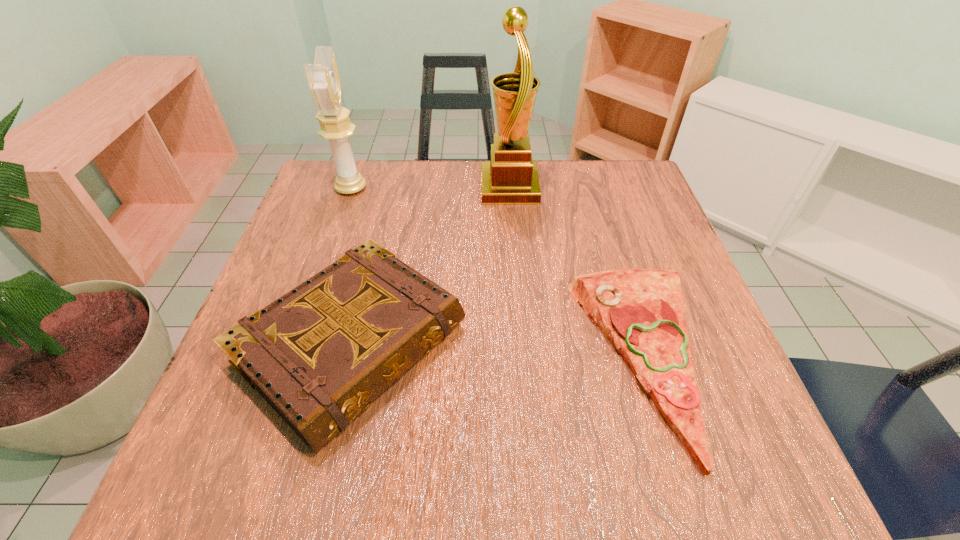
At what (x,y) coordinates should I click in order to perform the action: click on the tallest object. Please return your answer as a coordinate pair (x, y). The height and width of the screenshot is (540, 960). Looking at the image, I should click on (511, 177).

Identify the location of the third object from left to right. (511, 177).

The image size is (960, 540). What are the coordinates of `the left award` in the screenshot? It's located at (323, 77).

Identify the location of the third shortest object. (323, 77).

Find the location of a particular element. The image size is (960, 540). hardback book is located at coordinates (319, 355).

You are a GUI agent. You are given a task and a screenshot of the screen. Output one action in this format:
    pyautogui.click(x=<x>, y=<y>)
    Task: Click on the rightmost object
    This screenshot has height=540, width=960.
    Given the screenshot: What is the action you would take?
    pyautogui.click(x=641, y=311)

This screenshot has height=540, width=960. What are the coordinates of `the shortest object` in the screenshot? It's located at (641, 311).

At what (x,y) coordinates should I click in order to perform the action: click on free space located 0.380m on the front-facing side of the right award. Please return your answer as a coordinate pair (x, y). Looking at the image, I should click on (333, 188).

You are a GUI agent. You are given a task and a screenshot of the screen. Output one action in this format:
    pyautogui.click(x=<x>, y=<y>)
    Task: Click on the vacant region located on the front-facing side of the right award
    The image size is (960, 540).
    Given the screenshot: What is the action you would take?
    pyautogui.click(x=396, y=188)

Find the location of a particular element. Image resolution: width=960 pixels, height=540 pixels. free space located 0.100m on the front-facing side of the right award is located at coordinates (443, 188).